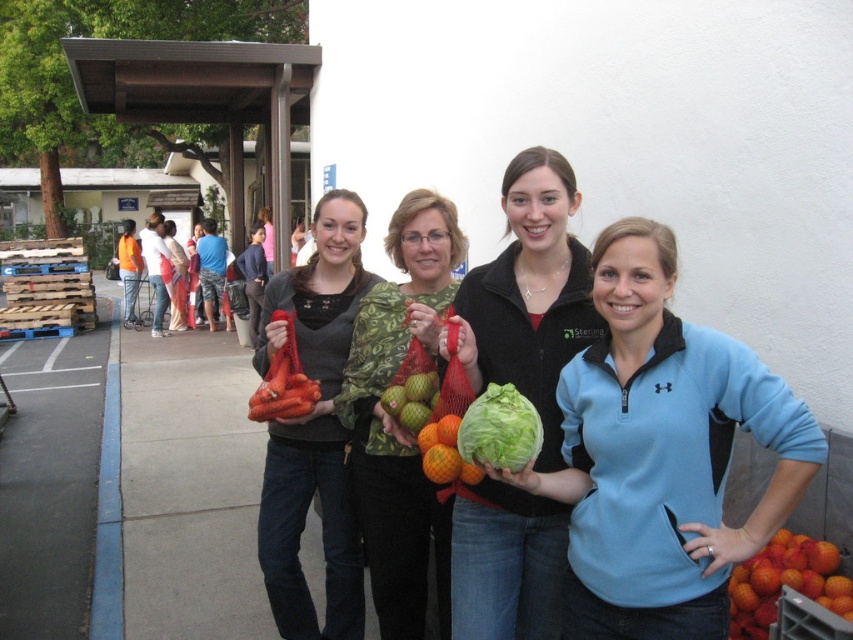
You are organizing a food display and need to know which item is shorter between the green leafy lettuce at center and the matte orange carrots at center. Which one should you place on the lower shelf to avoid blocking the view of the taller item?

The green leafy lettuce at center is not as tall as matte orange carrots at center, so you should place the green leafy lettuce at center on the lower shelf to ensure the taller matte orange carrots at center is visible.

You are standing in a line to receive food items and see the green leafy lettuce at center. If you want to grab it, will you be able to reach it without moving closer?

The green leafy lettuce at center is 2.10 meters from viewer, so you would need to move closer to reach it since it is too far away.

Based on the photo, you are a photographer trying to capture a closeup of the green leafy lettuce at center and the orange mesh bag of carrots at center. Which object should you focus on first if you want to ensure both are in focus, considering their heights?

The green leafy lettuce at center is taller than the orange mesh bag of carrots at center. To ensure both are in focus, focus on the taller object first, which is the green leafy lettuce at center, as it requires adjusting the camera to a greater distance.